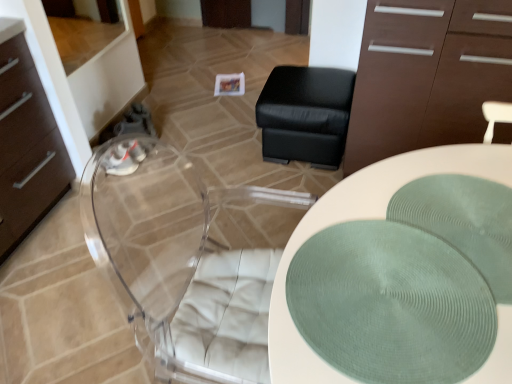
You are a GUI agent. You are given a task and a screenshot of the screen. Output one action in this format:
    pyautogui.click(x=<x>, y=<y>)
    Task: Click on the blank space above green textured placemat at center (from a real-world perspective)
    
    Given the screenshot: What is the action you would take?
    pyautogui.click(x=464, y=234)